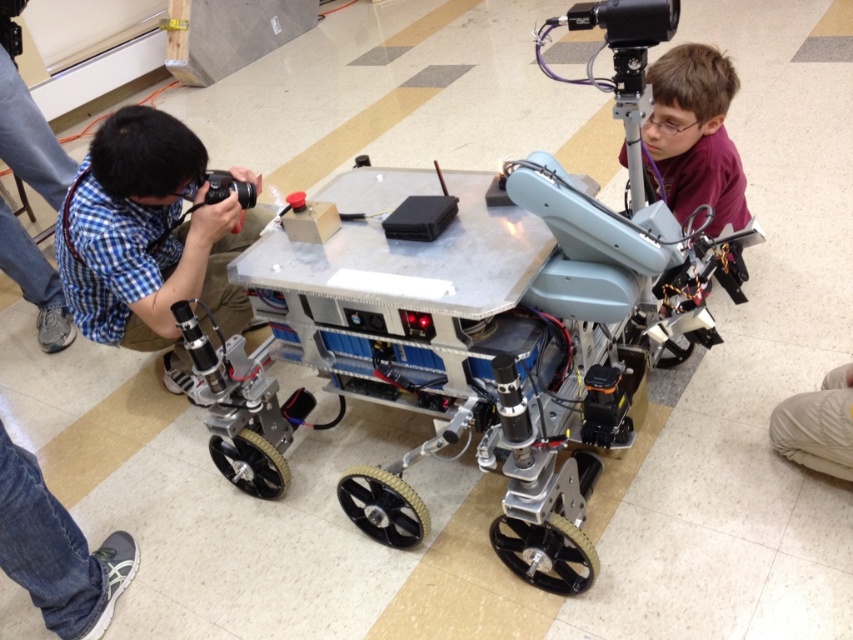
Question: Which of these objects is positioned closest to the black plastic camera at left?

Choices:
 (A) metallic robot at center
 (B) maroon shirt at upper right

Answer: (A)

Question: Does jeans at lower left appear on the left side of white fabric pants at lower right?

Choices:
 (A) no
 (B) yes

Answer: (B)

Question: Does jeans at lower left appear under black plastic camera at left?

Choices:
 (A) yes
 (B) no

Answer: (A)

Question: Which of the following is the farthest from the observer?

Choices:
 (A) (361, 324)
 (B) (815, 429)
 (C) (100, 556)
 (D) (703, 131)

Answer: (D)

Question: Which point is closer to the camera?

Choices:
 (A) metallic robot at center
 (B) black plastic camera at left
 (C) jeans at lower left
 (D) maroon shirt at upper right

Answer: (A)

Question: Is maroon shirt at upper right below black plastic camera at left?

Choices:
 (A) no
 (B) yes

Answer: (A)